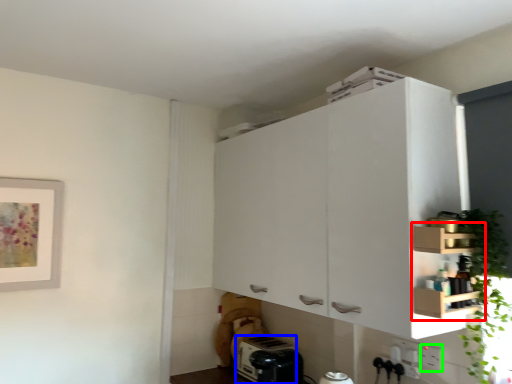
Question: Which object is the farthest from cabinetry (highlighted by a red box)? Choose among these: appliance (highlighted by a blue box) or electric outlet (highlighted by a green box).

Choices:
 (A) appliance
 (B) electric outlet

Answer: (A)